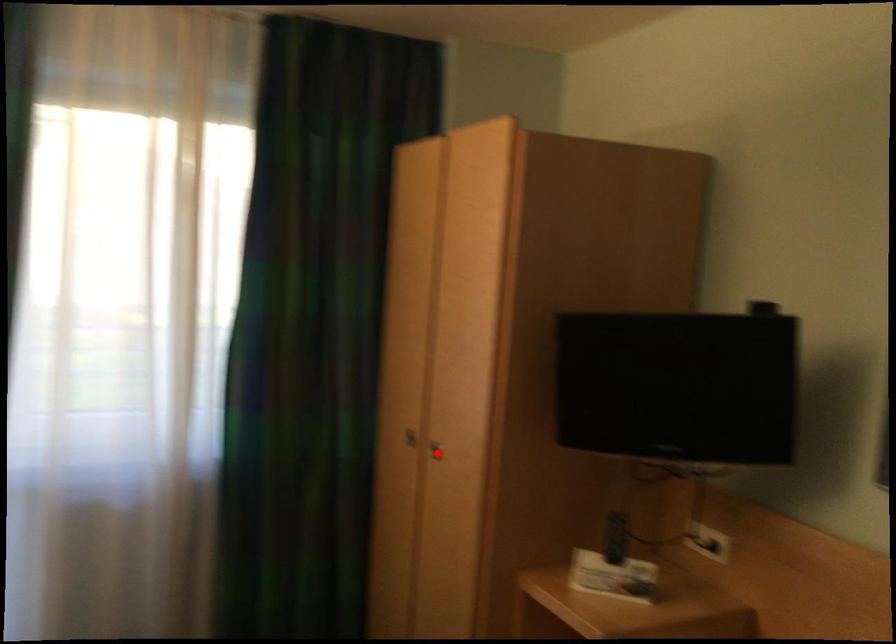
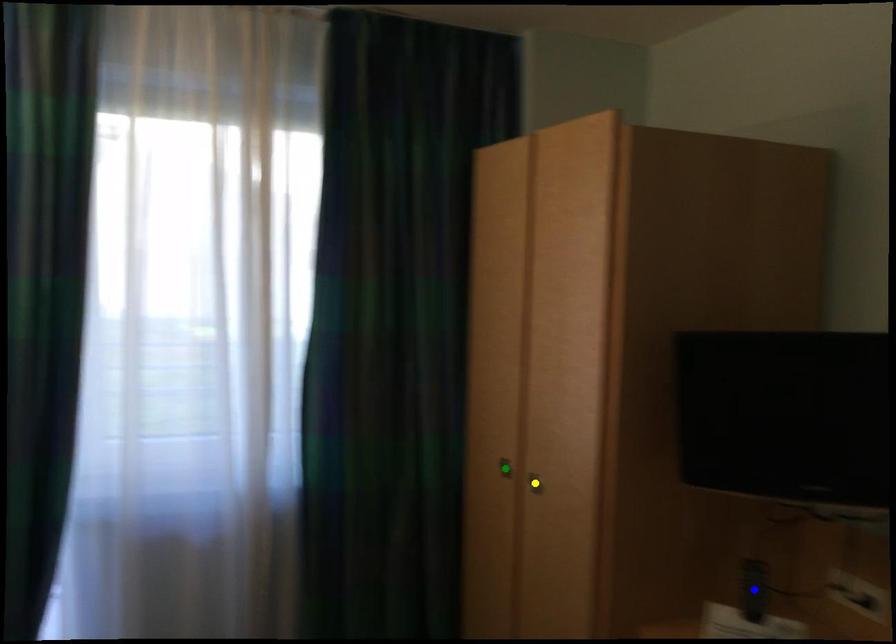
Question: I am providing you with two images of the same scene from different viewpoints. A red point is marked on the first image. You are given multiple points on the second image. Which mark in image 2 goes with the point in image 1?

Choices:
 (A) yellow point
 (B) green point
 (C) blue point

Answer: (A)